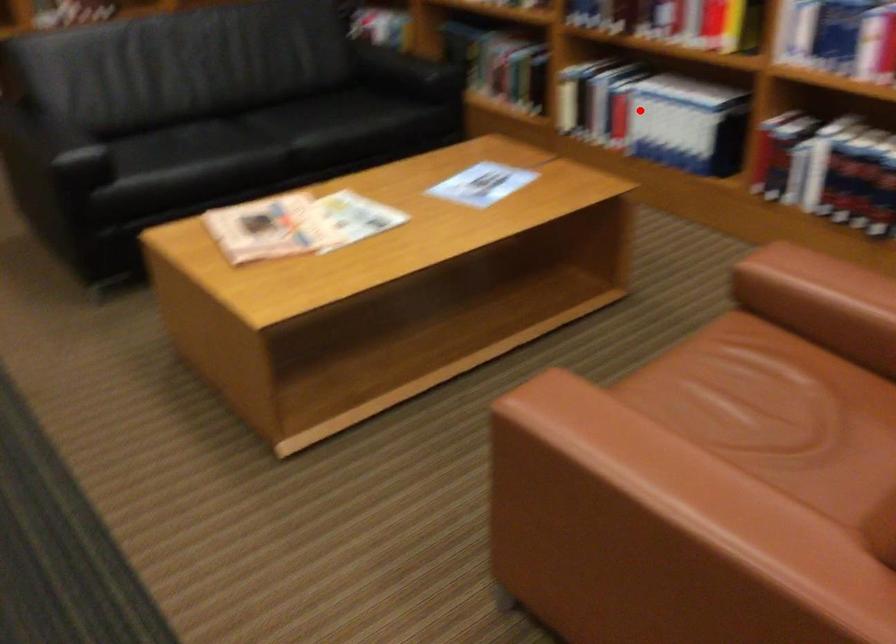
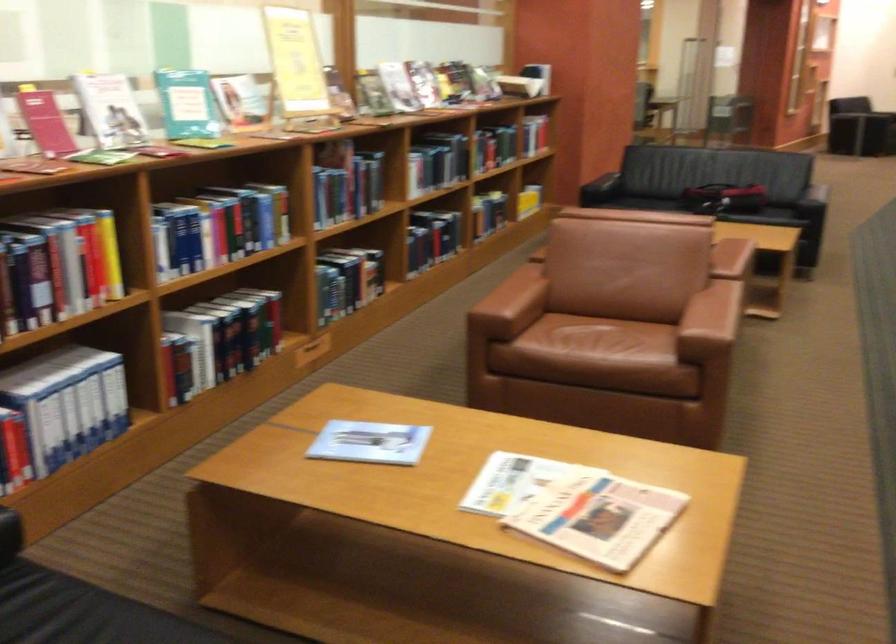
Find the pixel in the second image that matches the highlighted location in the first image.

(65, 404)